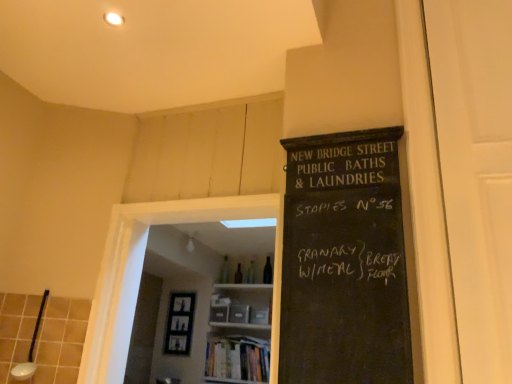
Question: Would you say hardcover books at center is a long distance from white ceramic spoon at lower left?

Choices:
 (A) yes
 (B) no

Answer: (A)

Question: Is hardcover books at center located outside white ceramic spoon at lower left?

Choices:
 (A) no
 (B) yes

Answer: (B)

Question: Is hardcover books at center further to the viewer compared to white ceramic spoon at lower left?

Choices:
 (A) yes
 (B) no

Answer: (A)

Question: Does hardcover books at center have a lesser width compared to white ceramic spoon at lower left?

Choices:
 (A) yes
 (B) no

Answer: (B)

Question: Is hardcover books at center positioned in front of white ceramic spoon at lower left?

Choices:
 (A) no
 (B) yes

Answer: (A)

Question: Based on their positions, is white ceramic spoon at lower left located to the left or right of wooden bookshelf at center?

Choices:
 (A) left
 (B) right

Answer: (A)

Question: In terms of width, does white ceramic spoon at lower left look wider or thinner when compared to wooden bookshelf at center?

Choices:
 (A) thin
 (B) wide

Answer: (A)

Question: Is white ceramic spoon at lower left spatially inside wooden bookshelf at center, or outside of it?

Choices:
 (A) outside
 (B) inside

Answer: (A)

Question: From the image's perspective, relative to wooden bookshelf at center, is white ceramic spoon at lower left above or below?

Choices:
 (A) below
 (B) above

Answer: (B)

Question: Is white matte door at right, the second glass door in the back-to-front sequence, to the left or to the right of white ceramic spoon at lower left in the image?

Choices:
 (A) left
 (B) right

Answer: (B)

Question: Considering their positions, is white matte door at right, which is the first glass door from front to back, located in front of or behind white ceramic spoon at lower left?

Choices:
 (A) behind
 (B) front

Answer: (B)

Question: From the image's perspective, relative to white ceramic spoon at lower left, is white matte door at right, which ranks as the 1th glass door in right-to-left order, above or below?

Choices:
 (A) above
 (B) below

Answer: (A)

Question: Is white matte door at right, marked as the 2th glass door in a left-to-right arrangement, spatially inside white ceramic spoon at lower left, or outside of it?

Choices:
 (A) outside
 (B) inside

Answer: (A)

Question: From their relative heights in the image, would you say white ceramic spoon at lower left is taller or shorter than transparent glass door at center, which is the 2th glass door from front to back?

Choices:
 (A) short
 (B) tall

Answer: (A)

Question: In the image, is white ceramic spoon at lower left on the left side or the right side of transparent glass door at center, which is the first glass door in left-to-right order?

Choices:
 (A) right
 (B) left

Answer: (B)